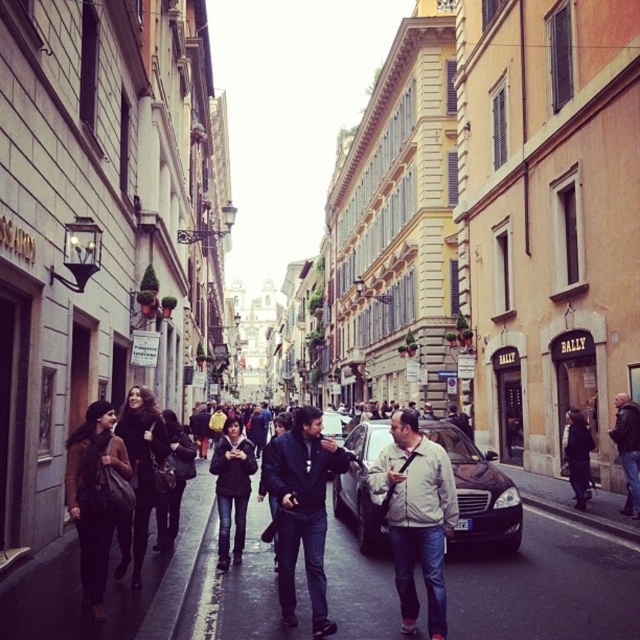
You are a delivery person trying to park your bike. You see the smooth asphalt pavement at center and the dark gray jacket at right. Which area is shorter in height and thus suitable for placing your bike stand?

The smooth asphalt pavement at center is shorter than the dark gray jacket at right, so it is suitable for placing the bike stand.